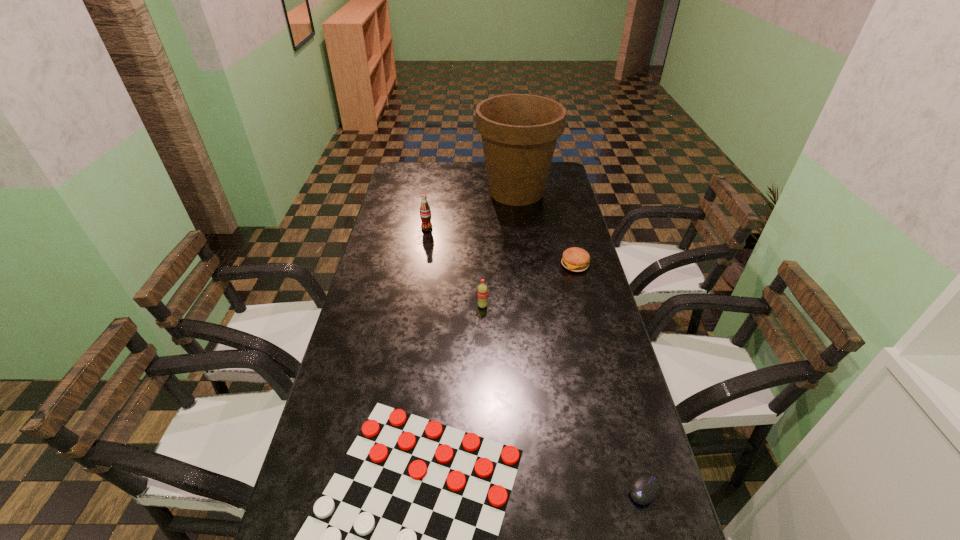
Point out which object is positioned as the third nearest to the shortest object. Please provide its 2D coordinates. Your answer should be formatted as a tuple, i.e. [(x, y)], where the tuple contains the x and y coordinates of a point satisfying the conditions above.

[(575, 259)]

Locate an element on the screen. object that stands as the closest to the shortest object is located at coordinates (645, 487).

Identify the location of free spot that satisfies the following two spatial constraints: 1. on the front side of the hamburger; 2. on the left side of the computer mouse. (633, 490).

Locate an element on the screen. The image size is (960, 540). vacant region that satisfies the following two spatial constraints: 1. on the back side of the third nearest object; 2. on the left side of the fourth nearest object is located at coordinates (482, 265).